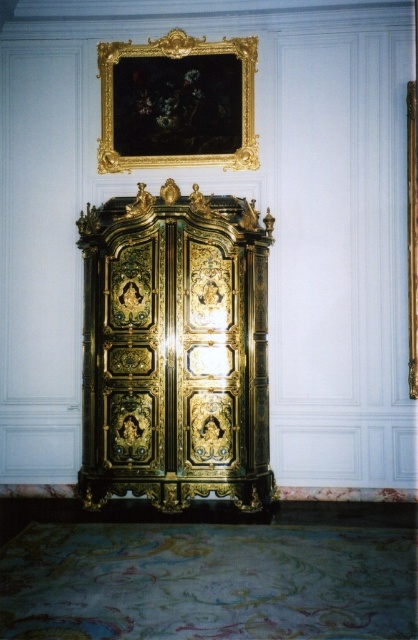
You are an interior designer assessing the placement of a new decorative item. You want to place it at the point with coordinates point (175, 349). Based on the scene, what object is located at that point?

The point (175, 349) is on the gold polished wood dresser at center.

You are an interior designer planning to place a new decorative item between the gold polished wood dresser at center and the gold ornate frame at upper center. Based on their sizes, which object should you consider placing closer to the wall to ensure proper spacing?

The gold polished wood dresser at center might be wider than the gold ornate frame at upper center, so placing the dresser closer to the wall would allow enough space for the frame to be positioned above it without overcrowding the area.